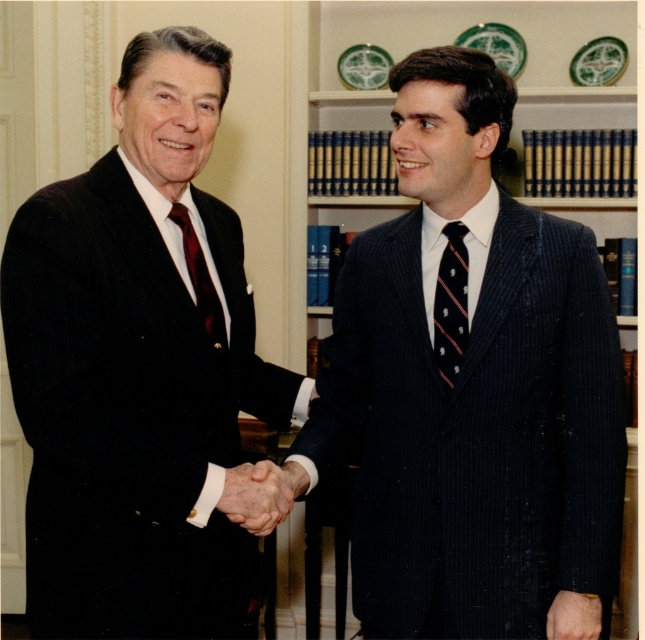
Question: Based on their relative distances, which object is nearer to the matte black suit at left?

Choices:
 (A) striped silk tie at right
 (B) matte dark red tie at left
 (C) pinstriped suit at center

Answer: (B)

Question: Which object is closer to the camera taking this photo?

Choices:
 (A) matte dark red tie at left
 (B) smooth skin hand at lower right
 (C) pinstriped suit at center

Answer: (C)

Question: In this image, where is striped silk tie at right located relative to smooth skin handshake at center?

Choices:
 (A) below
 (B) above

Answer: (B)

Question: Can you confirm if striped silk tie at right is smaller than smooth skin handshake at center?

Choices:
 (A) yes
 (B) no

Answer: (A)

Question: Can you confirm if matte black suit at left is positioned above smooth skin hand at lower right?

Choices:
 (A) no
 (B) yes

Answer: (B)

Question: Which object is closer to the camera taking this photo?

Choices:
 (A) matte dark red tie at left
 (B) smooth skin handshake at center

Answer: (B)